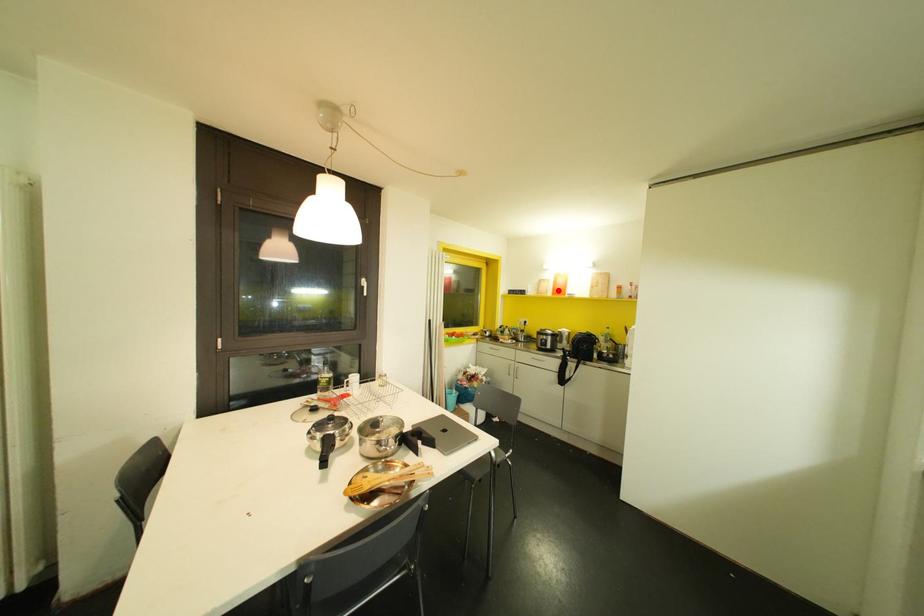
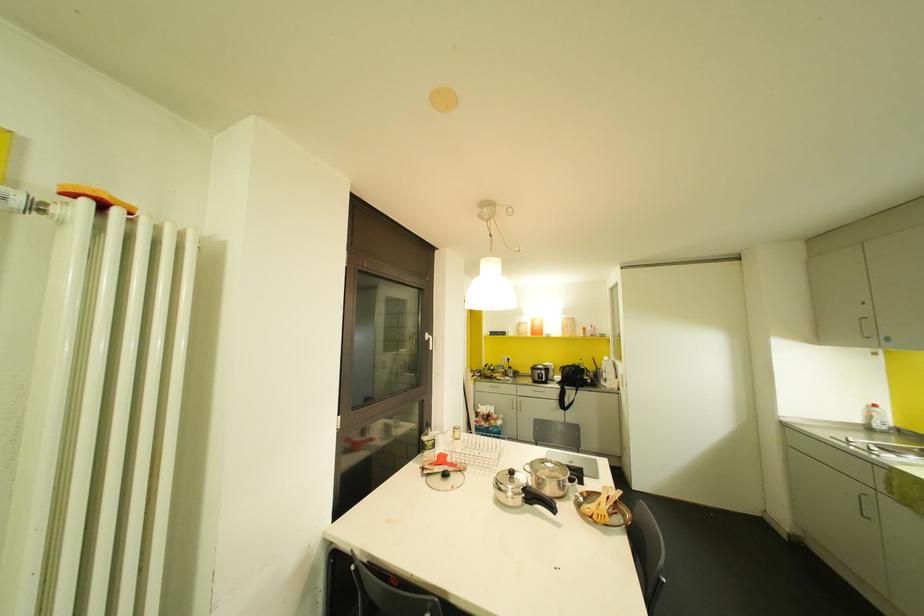
In the second image, find the point that corresponds to the highlighted location in the first image.

(536, 331)